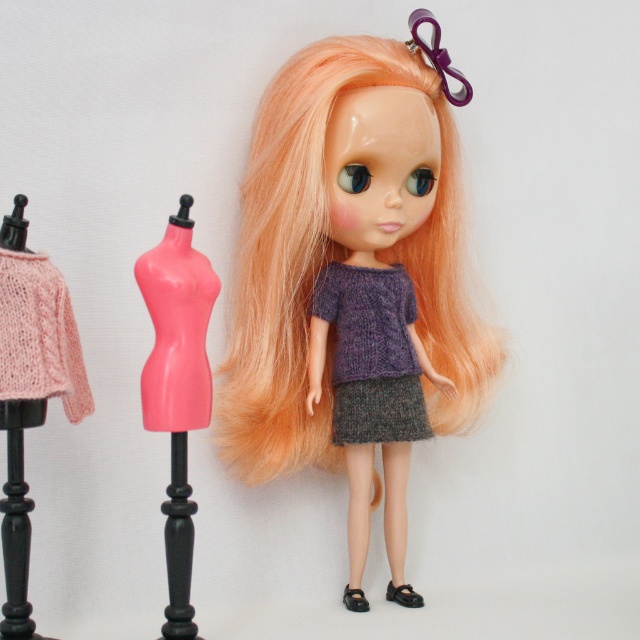
Question: Among these objects, which one is nearest to the camera?

Choices:
 (A) knitted purple sweater at center
 (B) blonde silky hair at center
 (C) pink plastic dress form at left

Answer: (C)

Question: Observing the image, what is the correct spatial positioning of blonde silky hair at center in reference to knitted purple sweater at center?

Choices:
 (A) above
 (B) below

Answer: (A)

Question: Is blonde silky hair at center wider than knitted purple sweater at center?

Choices:
 (A) yes
 (B) no

Answer: (A)

Question: Which object appears closest to the camera in this image?

Choices:
 (A) knitted purple sweater at center
 (B) blonde silky hair at center

Answer: (B)

Question: Is blonde silky hair at center above pink plastic dress form at left?

Choices:
 (A) no
 (B) yes

Answer: (B)

Question: Estimate the real-world distances between objects in this image. Which object is closer to the knitted purple sweater at center?

Choices:
 (A) blonde silky hair at center
 (B) pink plastic dress form at left

Answer: (A)